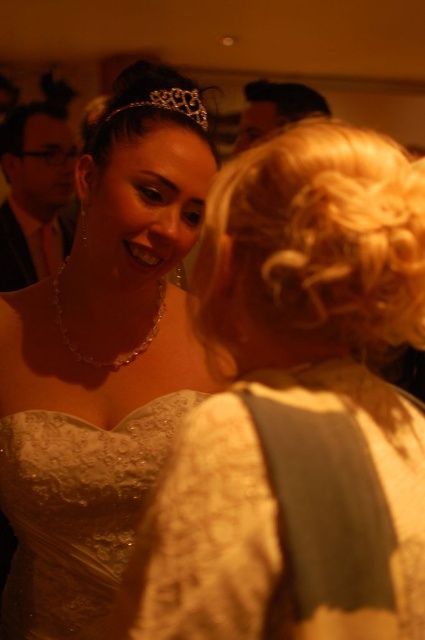
This screenshot has height=640, width=425. Describe the element at coordinates (99, 365) in the screenshot. I see `lace dress at center` at that location.

Which is below, lace dress at center or matte black suit at left?

Positioned lower is lace dress at center.

Where is `lace dress at center`? The image size is (425, 640). lace dress at center is located at coordinates (99, 365).

Find the location of `lace dress at center`. lace dress at center is located at coordinates (99, 365).

Does matte black suit at left have a lesser width compared to matte black hair at upper center?

Correct, matte black suit at left's width is less than matte black hair at upper center's.

Locate an element on the screen. This screenshot has height=640, width=425. matte black suit at left is located at coordinates (34, 193).

Can you confirm if lace dress at center is positioned above lace fabric dress at center?

Indeed, lace dress at center is positioned over lace fabric dress at center.

The image size is (425, 640). What are the coordinates of `lace dress at center` in the screenshot? It's located at (99, 365).